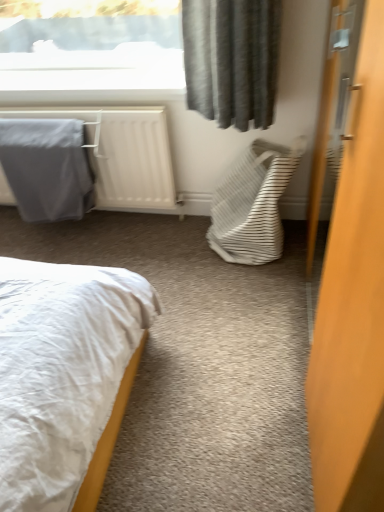
The image size is (384, 512). I want to click on free space to the left of wooden door at right, so click(x=202, y=346).